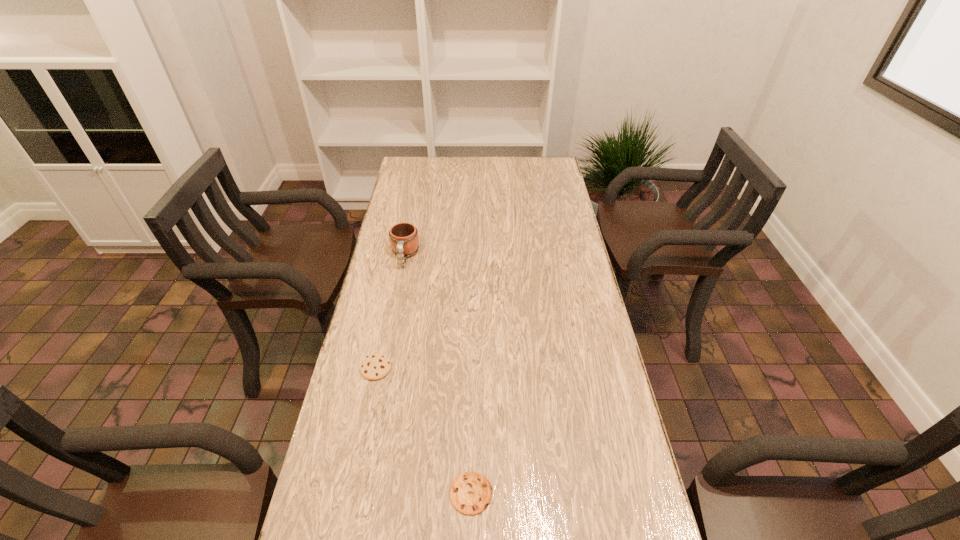
At what (x,y) coordinates should I click in order to perform the action: click on the tallest object. Please return your answer as a coordinate pair (x, y). The width and height of the screenshot is (960, 540). Looking at the image, I should click on (404, 240).

This screenshot has width=960, height=540. Find the location of `the farthest object`. the farthest object is located at coordinates (404, 240).

What are the coordinates of `the farther cookie` in the screenshot? It's located at (376, 366).

This screenshot has width=960, height=540. What are the coordinates of `the second tallest object` in the screenshot? It's located at (376, 366).

Locate an element on the screen. The image size is (960, 540). the shortest object is located at coordinates (471, 492).

Identify the location of the nearest object. (471, 492).

I want to click on vacant space located 0.080m on the side of the mug with the handle, so click(x=399, y=287).

You are a GUI agent. You are given a task and a screenshot of the screen. Output one action in this format:
    pyautogui.click(x=<x>, y=<y>)
    Task: Click on the free space located 0.080m on the back of the farther cookie
    This screenshot has height=540, width=960.
    Given the screenshot: What is the action you would take?
    pyautogui.click(x=383, y=334)

This screenshot has height=540, width=960. Identify the location of vacant space located 0.050m on the left of the rightmost object. (428, 493).

Identify the location of mug situated at the left edge. This screenshot has height=540, width=960. (404, 240).